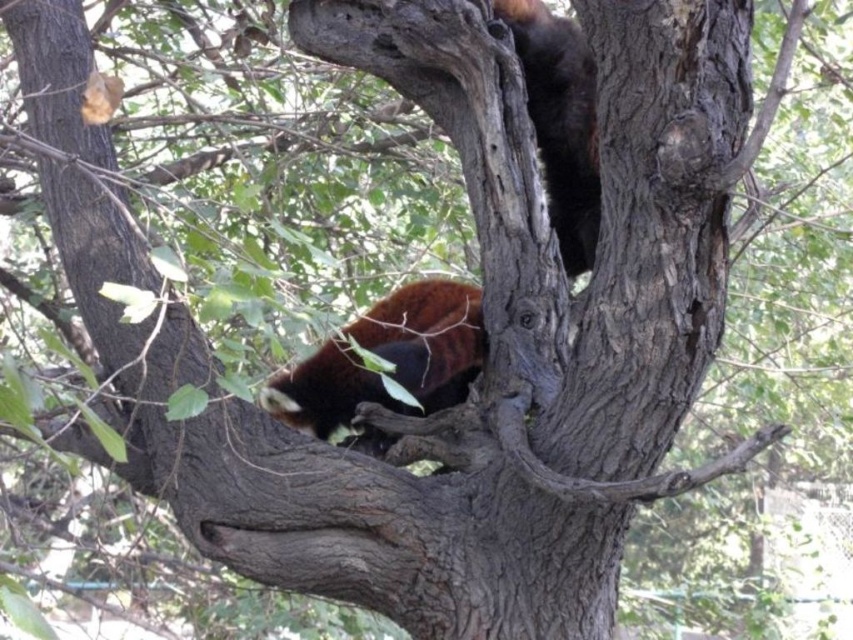
Can you confirm if brown furry animal at center is positioned to the right of fuzzy brown bear at upper right?

No, brown furry animal at center is not to the right of fuzzy brown bear at upper right.

Is brown furry animal at center further to camera compared to fuzzy brown bear at upper right?

No, it is in front of fuzzy brown bear at upper right.

The height and width of the screenshot is (640, 853). In order to click on brown furry animal at center in this screenshot , I will do `click(387, 358)`.